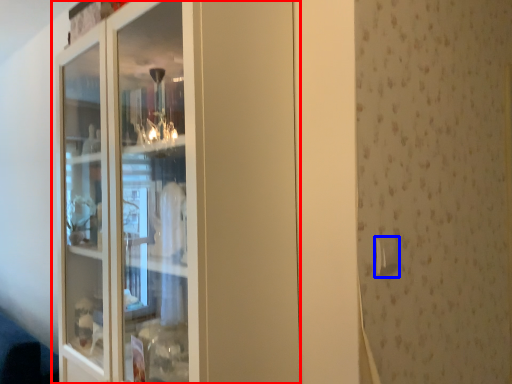
Question: Which object is further to the camera taking this photo, cupboard (highlighted by a red box) or door handle (highlighted by a blue box)?

Choices:
 (A) cupboard
 (B) door handle

Answer: (B)